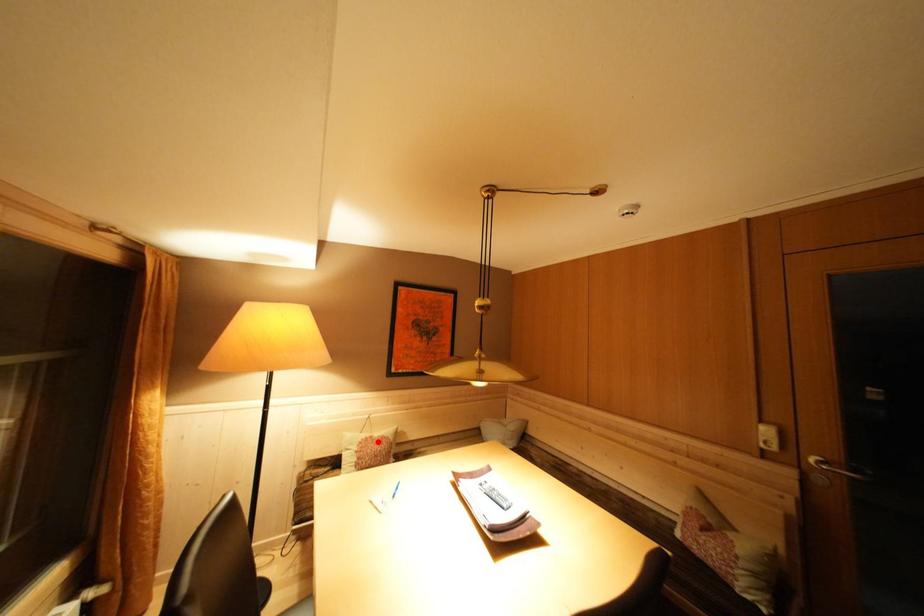
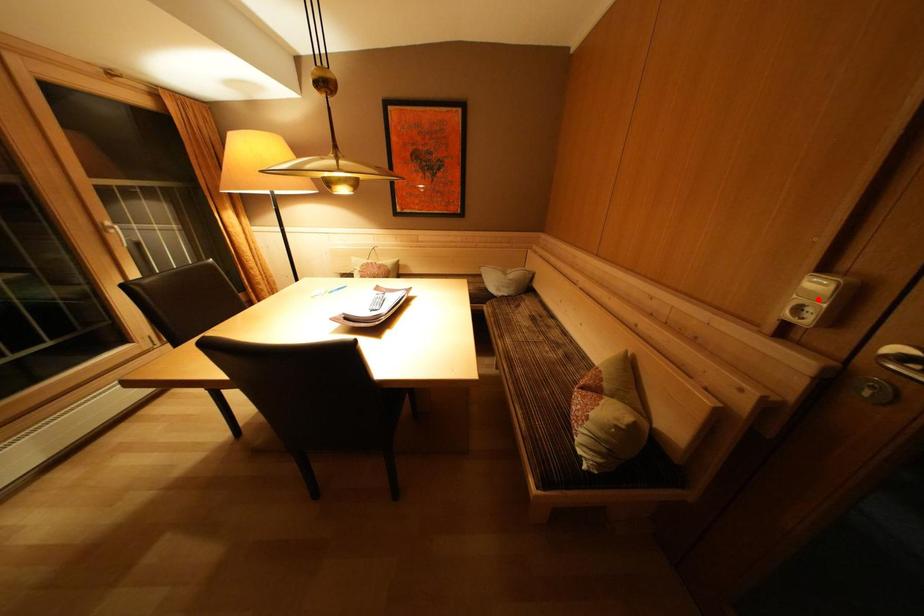
I am providing you with two images of the same scene from different viewpoints. A red point is marked on the first image and another point is marked on the second image. Does the point marked in image1 correspond to the same location as the one in image2?

No